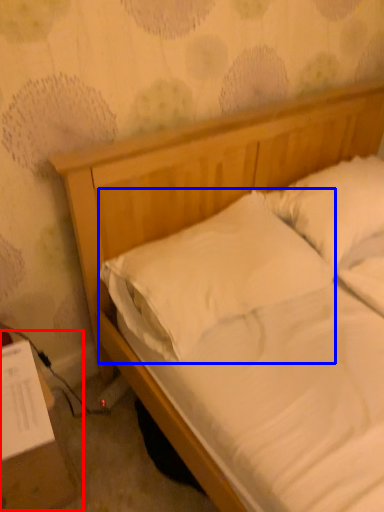
Question: Among these objects, which one is farthest to the camera, table (highlighted by a red box) or pillow (highlighted by a blue box)?

Choices:
 (A) table
 (B) pillow

Answer: (B)